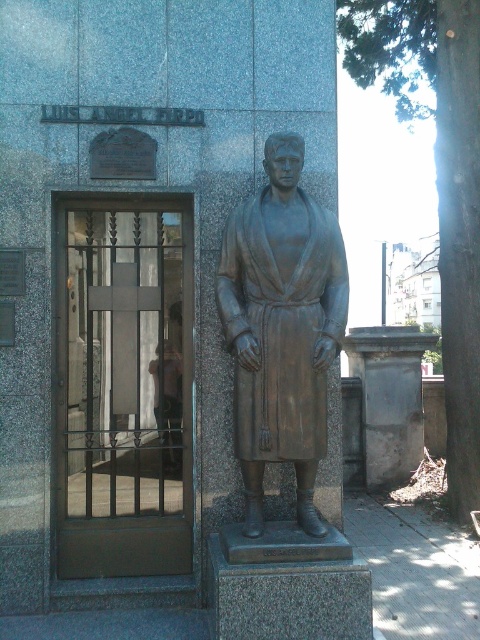
Who is taller, dark brown metal gate at left or bronze statue at center?

With more height is dark brown metal gate at left.

What are the coordinates of `dark brown metal gate at left` in the screenshot? It's located at (123, 387).

This screenshot has width=480, height=640. What do you see at coordinates (123, 387) in the screenshot?
I see `dark brown metal gate at left` at bounding box center [123, 387].

Image resolution: width=480 pixels, height=640 pixels. I want to click on dark brown metal gate at left, so point(123,387).